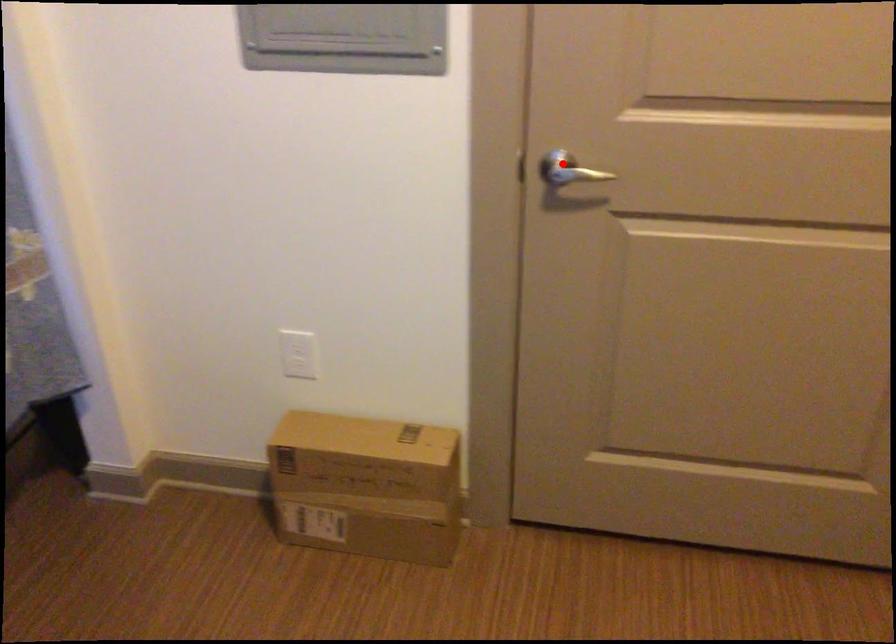
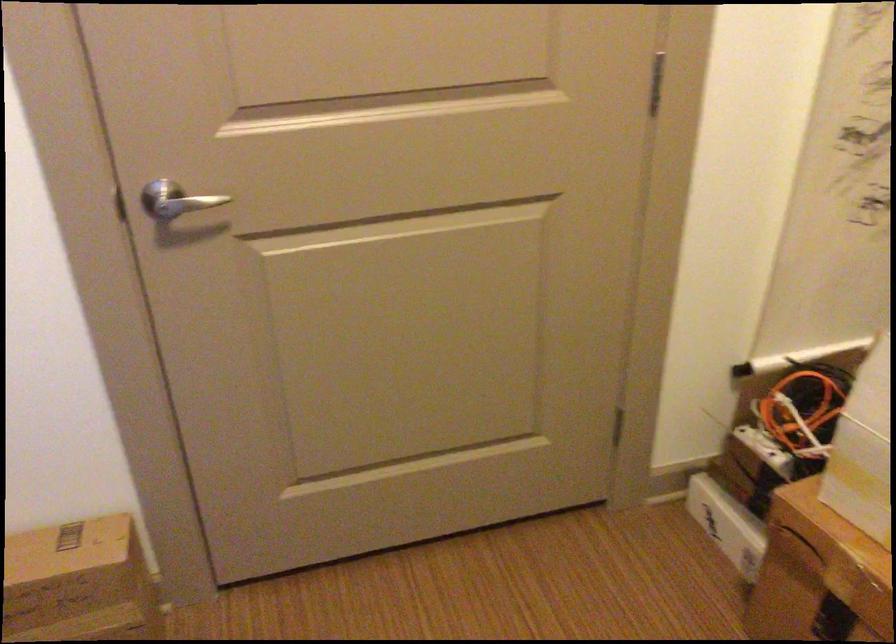
Find the pixel in the second image that matches the highlighted location in the first image.

(176, 200)